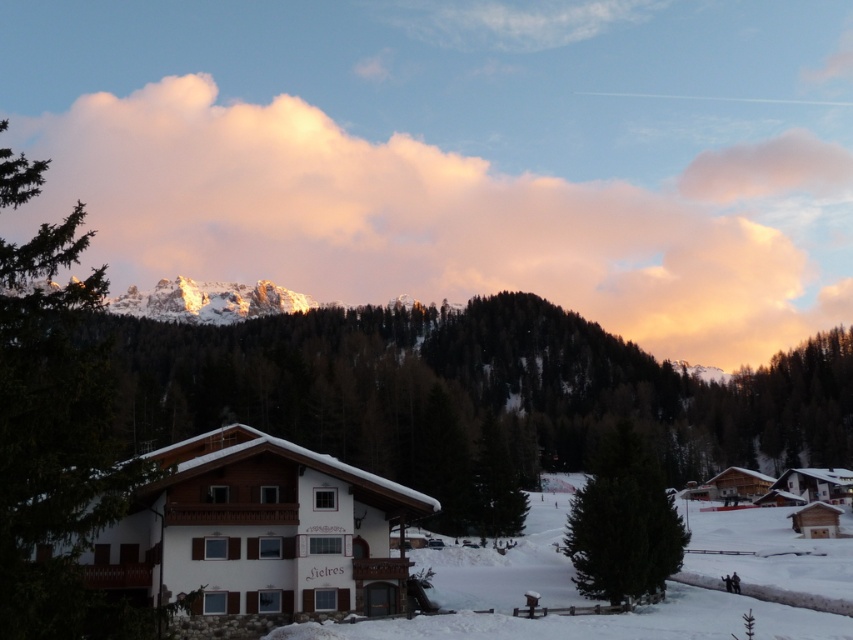
You are an airplane passenger looking out the window and see the white fluffy cloud at upper center and the green matte tree at center. Which object is closer to the airplane?

The white fluffy cloud at upper center is closer to the airplane because the green matte tree at center is behind it.

You are a hiker planning to take a photo of the green matte tree at center and the pink fluffy cloud at upper center. Based on their positions, which object should you focus on first to ensure both are in the frame?

The green matte tree at center should be focused on first since it is located below the pink fluffy cloud at upper center, so adjusting the camera to include the lower tree will naturally include the cloud above.